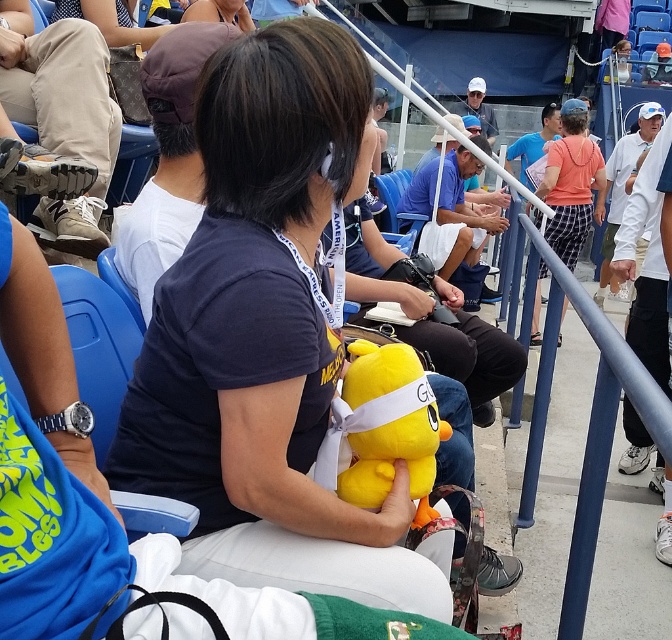
Who is positioned more to the right, matte yellow plush toy at center or orange cotton shirt at center?

orange cotton shirt at center is more to the right.

Is point (183, 404) positioned behind point (562, 106)?

No, it is in front of (562, 106).

The height and width of the screenshot is (640, 672). What do you see at coordinates (241, 381) in the screenshot?
I see `matte yellow plush toy at center` at bounding box center [241, 381].

Where is `matte yellow plush toy at center`? Image resolution: width=672 pixels, height=640 pixels. matte yellow plush toy at center is located at coordinates (241, 381).

Between point (355, 477) and point (585, 129), which one is positioned in front?

Point (355, 477) is more forward.

Find the location of `yellow plush toy at center`. yellow plush toy at center is located at coordinates (388, 426).

Between matte yellow plush toy at center and yellow plush toy at center, which one has more height?

matte yellow plush toy at center

Who is lower down, matte yellow plush toy at center or yellow plush toy at center?

yellow plush toy at center

Locate an element on the screen. Image resolution: width=672 pixels, height=640 pixels. matte yellow plush toy at center is located at coordinates (241, 381).